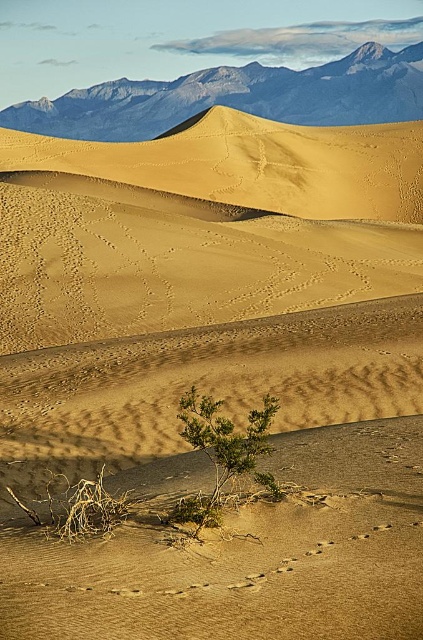
You are a desert explorer who wants to place a flag at the exact center of the sandy yellow dune at upper center. According to the coordinates provided, where should you place the flag?

The sandy yellow dune at upper center is located at coordinates point [252,164], so you should place the flag at point [252,164].

You are standing in the desert scene and want to take a photo of the rocky gray mountain range at upper center and the green leafy shrub at center. Which object should you focus on first if you want both to be in sharp focus?

The rocky gray mountain range at upper center is above the green leafy shrub at center, so you should focus on the rocky gray mountain range at upper center first to ensure both are in sharp focus.